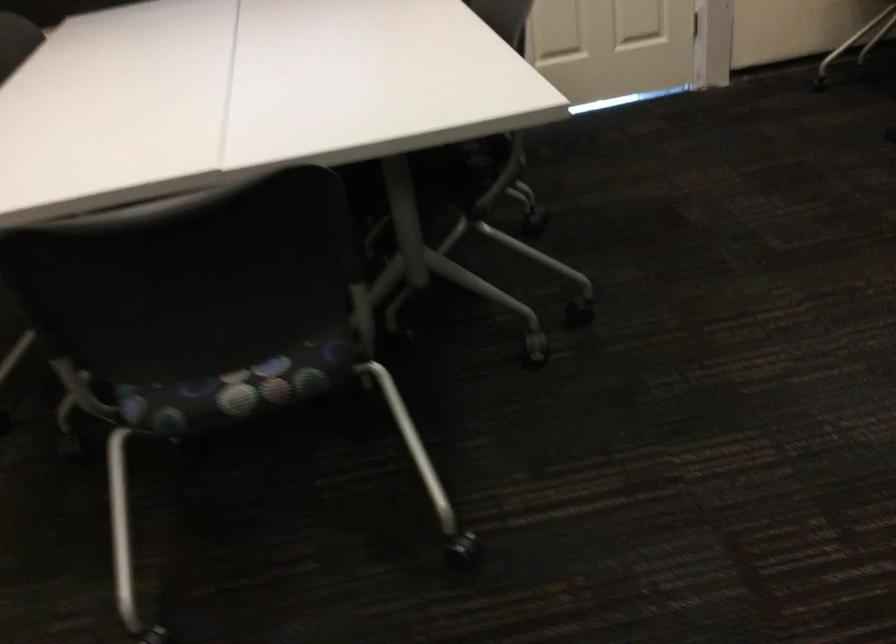
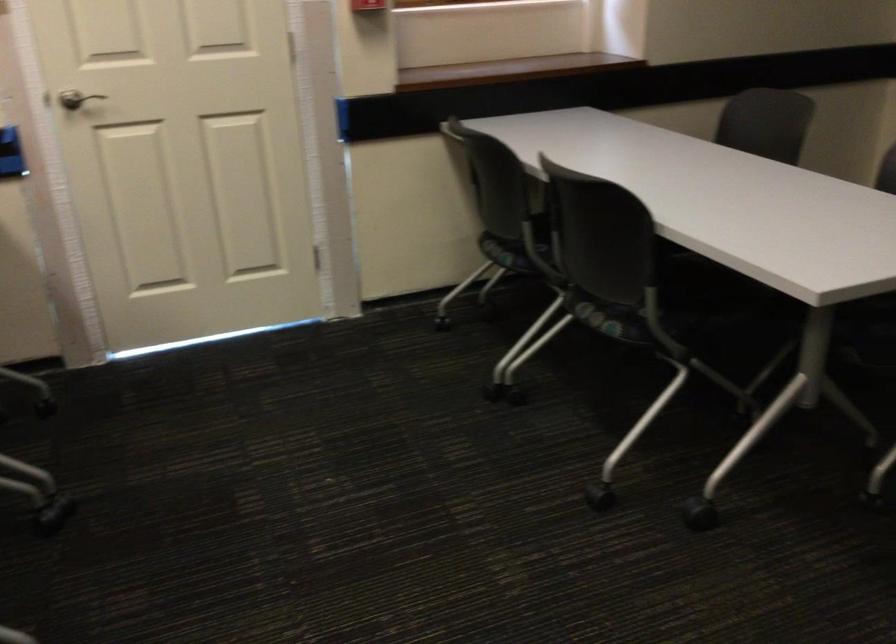
In a continuous first-person perspective shot, in which direction is the camera moving?

The cameraman moved toward right, forward.